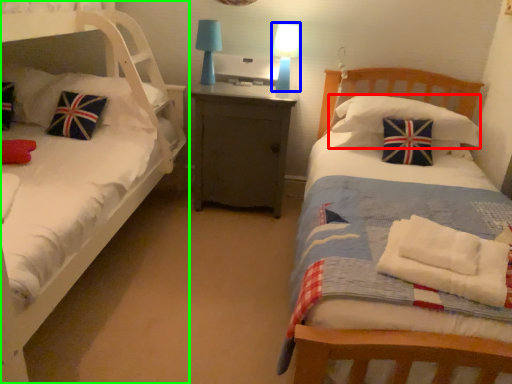
Question: Which is nearer to the pillow (highlighted by a red box)? table lamp (highlighted by a blue box) or bed (highlighted by a green box).

Choices:
 (A) table lamp
 (B) bed

Answer: (A)